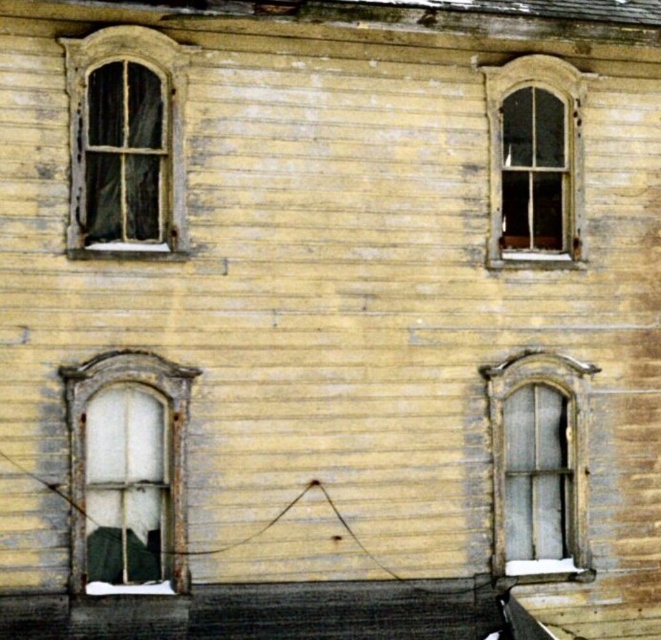
This screenshot has height=640, width=661. What are the coordinates of `wooden window at upper left` in the screenshot? It's located at (126, 141).

Who is positioned more to the left, wooden window at upper left or wooden window at upper right?

wooden window at upper left

Is point (130, 88) closer to camera compared to point (502, 230)?

That is True.

Find the location of a particular element. wooden window at upper left is located at coordinates (126, 141).

Describe the element at coordinates (128, 467) in the screenshot. I see `translucent glass window at center` at that location.

Find the location of a particular element. Image resolution: width=661 pixels, height=640 pixels. translucent glass window at center is located at coordinates (128, 467).

Is translucent glass window at center positioned in front of wooden window at upper left?

Yes, translucent glass window at center is in front of wooden window at upper left.

Between translucent glass window at center and wooden window at upper left, which one has more height?

translucent glass window at center

Between point (97, 458) and point (175, 104), which one is positioned behind?

Point (175, 104)

Find the location of a particular element. Image resolution: width=661 pixels, height=640 pixels. translucent glass window at center is located at coordinates (128, 467).